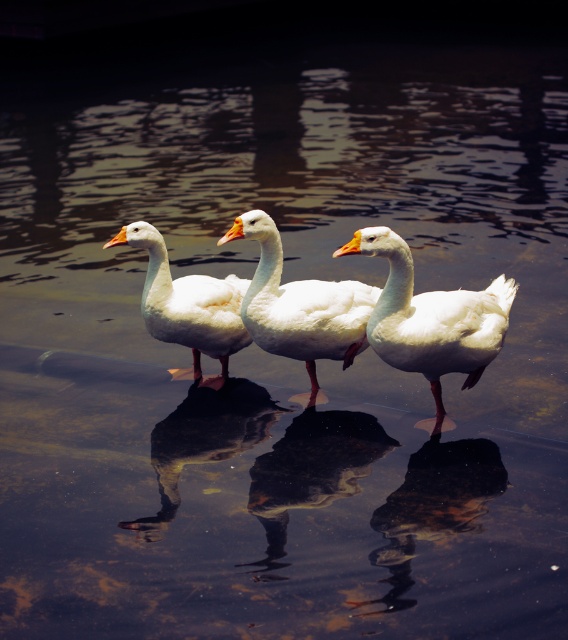
You are a photographer trying to capture the two ducks in the scene. You want to position your camera so that the white glossy duck at center is to the right of the white matte duck at center. Is this possible based on their current positions?

The white glossy duck at center is currently to the left of the white matte duck at center, so repositioning the camera to have the white glossy duck at center on the right would require moving around the scene to a viewpoint where their positions appear reversed. However, without physically moving the ducks, this might not be achievable from the current perspective.